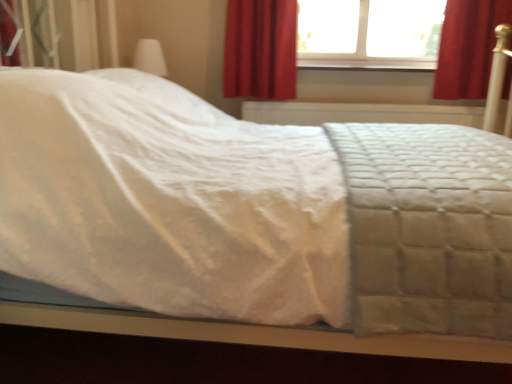
Image resolution: width=512 pixels, height=384 pixels. I want to click on transparent glass window at upper center, so click(x=369, y=33).

This screenshot has height=384, width=512. What do you see at coordinates (369, 33) in the screenshot?
I see `transparent glass window at upper center` at bounding box center [369, 33].

Where is `red velvet curtain at upper center, acting as the 2th curtain starting from the right`? red velvet curtain at upper center, acting as the 2th curtain starting from the right is located at coordinates (260, 49).

Measure the distance between point [367,61] and camera.

A distance of 9.39 feet exists between point [367,61] and camera.

Image resolution: width=512 pixels, height=384 pixels. Describe the element at coordinates (251, 209) in the screenshot. I see `white quilted fabric at center` at that location.

Where is `transparent glass window at upper center`? The image size is (512, 384). transparent glass window at upper center is located at coordinates (369, 33).

Considering the positions of objects smooth wood window sill at upper center and red velvet curtain at upper center, acting as the first curtain starting from the left, in the image provided, who is more to the left, smooth wood window sill at upper center or red velvet curtain at upper center, acting as the first curtain starting from the left,?

red velvet curtain at upper center, acting as the first curtain starting from the left, is more to the left.

From a real-world perspective, who is located lower, smooth wood window sill at upper center or red velvet curtain at upper center, acting as the 2th curtain starting from the right?

In real-world perspective, smooth wood window sill at upper center is lower.

In the scene shown: Considering the sizes of objects smooth wood window sill at upper center and red velvet curtain at upper center, acting as the 2th curtain starting from the right, in the image provided, who is bigger, smooth wood window sill at upper center or red velvet curtain at upper center, acting as the 2th curtain starting from the right,?

Bigger between the two is red velvet curtain at upper center, acting as the 2th curtain starting from the right.

In order to click on curtain below the red velvet curtain at upper right, the 1th curtain when ordered from right to left (from a real-world perspective) in this screenshot , I will do `click(260, 49)`.

Could you measure the distance between red velvet curtain at upper center, acting as the first curtain starting from the left, and red velvet curtain at upper right, the second curtain when ordered from left to right?

red velvet curtain at upper center, acting as the first curtain starting from the left, and red velvet curtain at upper right, the second curtain when ordered from left to right, are 1.08 meters apart from each other.

From the picture: Which is more to the right, red velvet curtain at upper center, acting as the 2th curtain starting from the right, or red velvet curtain at upper right, the 1th curtain when ordered from right to left?

From the viewer's perspective, red velvet curtain at upper right, the 1th curtain when ordered from right to left, appears more on the right side.

From the image's perspective, does red velvet curtain at upper center, acting as the 2th curtain starting from the right, appear higher than red velvet curtain at upper right, the 1th curtain when ordered from right to left?

Incorrect, from the image's perspective, red velvet curtain at upper center, acting as the 2th curtain starting from the right, is lower than red velvet curtain at upper right, the 1th curtain when ordered from right to left.

I want to click on window sill that is on the right side of transparent glass window at upper center, so click(368, 64).

From a real-world perspective, is transparent glass window at upper center over smooth wood window sill at upper center?

Correct, in the physical world, transparent glass window at upper center is higher than smooth wood window sill at upper center.

Which object is thinner, transparent glass window at upper center or smooth wood window sill at upper center?

With smaller width is transparent glass window at upper center.

Considering the relative sizes of transparent glass window at upper center and smooth wood window sill at upper center in the image provided, is transparent glass window at upper center taller than smooth wood window sill at upper center?

Indeed, transparent glass window at upper center has a greater height compared to smooth wood window sill at upper center.

From the image's perspective, is smooth wood window sill at upper center beneath red velvet curtain at upper right, the second curtain when ordered from left to right?

Yes, from the image's perspective, smooth wood window sill at upper center is below red velvet curtain at upper right, the second curtain when ordered from left to right.

How many degrees apart are the facing directions of smooth wood window sill at upper center and red velvet curtain at upper right, the second curtain when ordered from left to right?

The angle between the facing direction of smooth wood window sill at upper center and the facing direction of red velvet curtain at upper right, the second curtain when ordered from left to right, is 0.442 degrees.

Could red velvet curtain at upper right, the 1th curtain when ordered from right to left, be considered to be inside smooth wood window sill at upper center?

No, red velvet curtain at upper right, the 1th curtain when ordered from right to left, is located outside of smooth wood window sill at upper center.

Between smooth wood window sill at upper center and red velvet curtain at upper right, the second curtain when ordered from left to right, which one appears on the left side from the viewer's perspective?

smooth wood window sill at upper center.

Consider the image. Between red velvet curtain at upper right, the second curtain when ordered from left to right, and smooth wood window sill at upper center, which one is positioned behind?

smooth wood window sill at upper center is further away from the camera.

Is red velvet curtain at upper right, the 1th curtain when ordered from right to left, not inside smooth wood window sill at upper center?

Yes, red velvet curtain at upper right, the 1th curtain when ordered from right to left, is located beyond the bounds of smooth wood window sill at upper center.

Where is `curtain that is the 2nd one when counting forward from the smooth wood window sill at upper center`? This screenshot has width=512, height=384. curtain that is the 2nd one when counting forward from the smooth wood window sill at upper center is located at coordinates (468, 47).

Is point (450, 50) more distant than point (373, 59)?

No, (450, 50) is closer to viewer.

Which is in front, white quilted fabric at center or smooth wood window sill at upper center?

white quilted fabric at center.

Can you confirm if white quilted fabric at center is positioned to the left of smooth wood window sill at upper center?

Yes, white quilted fabric at center is to the left of smooth wood window sill at upper center.

From a real-world perspective, is white quilted fabric at center located beneath smooth wood window sill at upper center?

Correct, in the physical world, white quilted fabric at center is lower than smooth wood window sill at upper center.

Looking at the image, does white quilted fabric at center seem bigger or smaller compared to smooth wood window sill at upper center?

Considering their sizes, white quilted fabric at center takes up more space than smooth wood window sill at upper center.

The height and width of the screenshot is (384, 512). Find the location of `curtain on the left of transparent glass window at upper center`. curtain on the left of transparent glass window at upper center is located at coordinates (260, 49).

In the scene shown: Is transparent glass window at upper center thinner than red velvet curtain at upper center, acting as the first curtain starting from the left?

Yes.

Is point (424, 39) in front of point (293, 16)?

No, (424, 39) is further to viewer.

From a real-world perspective, between transparent glass window at upper center and red velvet curtain at upper center, acting as the first curtain starting from the left, who is vertically higher?

transparent glass window at upper center, from a real-world perspective.

This screenshot has height=384, width=512. In order to click on window sill behind the red velvet curtain at upper center, acting as the 2th curtain starting from the right in this screenshot , I will do `click(368, 64)`.

Where is `curtain lying on the left of red velvet curtain at upper right, the 1th curtain when ordered from right to left`? curtain lying on the left of red velvet curtain at upper right, the 1th curtain when ordered from right to left is located at coordinates (260, 49).

Based on their spatial positions, is white quilted fabric at center or red velvet curtain at upper center, acting as the 2th curtain starting from the right, closer to smooth wood window sill at upper center?

Based on the image, red velvet curtain at upper center, acting as the 2th curtain starting from the right, appears to be nearer to smooth wood window sill at upper center.

Looking at this image, based on their spatial positions, is smooth wood window sill at upper center or red velvet curtain at upper center, acting as the first curtain starting from the left, further from transparent glass window at upper center?

red velvet curtain at upper center, acting as the first curtain starting from the left, is further to transparent glass window at upper center.

Which object lies further to the anchor point red velvet curtain at upper center, acting as the first curtain starting from the left, red velvet curtain at upper right, the second curtain when ordered from left to right, or white quilted fabric at center?

white quilted fabric at center is further to red velvet curtain at upper center, acting as the first curtain starting from the left.

Estimate the real-world distances between objects in this image. Which object is closer to red velvet curtain at upper center, acting as the 2th curtain starting from the right, white quilted fabric at center or smooth wood window sill at upper center?

smooth wood window sill at upper center is positioned closer to the anchor red velvet curtain at upper center, acting as the 2th curtain starting from the right.

Looking at the image, which one is located closer to red velvet curtain at upper right, the second curtain when ordered from left to right, red velvet curtain at upper center, acting as the first curtain starting from the left, or white quilted fabric at center?

Among the two, red velvet curtain at upper center, acting as the first curtain starting from the left, is located nearer to red velvet curtain at upper right, the second curtain when ordered from left to right.

From the image, which object appears to be nearer to red velvet curtain at upper right, the second curtain when ordered from left to right, transparent glass window at upper center or white quilted fabric at center?

Among the two, transparent glass window at upper center is located nearer to red velvet curtain at upper right, the second curtain when ordered from left to right.

Estimate the real-world distances between objects in this image. Which object is closer to red velvet curtain at upper right, the 1th curtain when ordered from right to left, red velvet curtain at upper center, acting as the first curtain starting from the left, or smooth wood window sill at upper center?

Among the two, smooth wood window sill at upper center is located nearer to red velvet curtain at upper right, the 1th curtain when ordered from right to left.

Which object lies further to the anchor point red velvet curtain at upper right, the second curtain when ordered from left to right, white quilted fabric at center or red velvet curtain at upper center, acting as the first curtain starting from the left?

The object further to red velvet curtain at upper right, the second curtain when ordered from left to right, is white quilted fabric at center.

Where is `window sill between transparent glass window at upper center and red velvet curtain at upper right, the 1th curtain when ordered from right to left`? The width and height of the screenshot is (512, 384). window sill between transparent glass window at upper center and red velvet curtain at upper right, the 1th curtain when ordered from right to left is located at coordinates (368, 64).

Find the location of a particular element. The height and width of the screenshot is (384, 512). window sill between white quilted fabric at center and transparent glass window at upper center in the front-back direction is located at coordinates (368, 64).

The width and height of the screenshot is (512, 384). I want to click on window situated between red velvet curtain at upper center, acting as the first curtain starting from the left, and smooth wood window sill at upper center from left to right, so click(x=369, y=33).

Identify the location of curtain between white quilted fabric at center and red velvet curtain at upper center, acting as the 2th curtain starting from the right, along the z-axis. This screenshot has height=384, width=512. (468, 47).